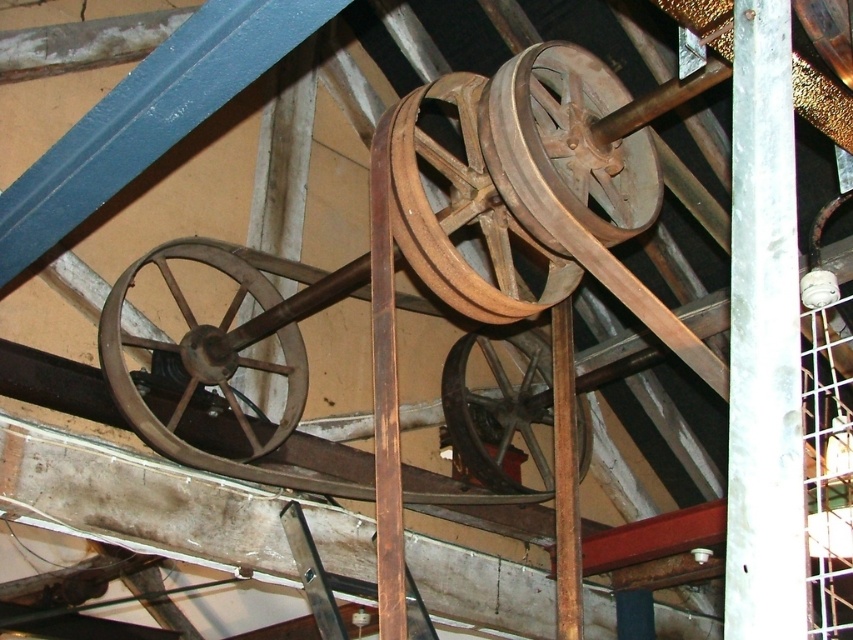
Question: Where is rustic wood wheel at center located in relation to wooden wheel at left in the image?

Choices:
 (A) right
 (B) left

Answer: (A)

Question: Is rustic wood wheel at center in front of wooden wheel at left?

Choices:
 (A) no
 (B) yes

Answer: (B)

Question: Is wooden pulley at center closer to the viewer compared to wooden wheel at center?

Choices:
 (A) no
 (B) yes

Answer: (B)

Question: Which point is closer to the camera?

Choices:
 (A) (469, 387)
 (B) (428, 212)

Answer: (B)

Question: Which point is farther to the camera?

Choices:
 (A) (463, 358)
 (B) (537, 122)
 (C) (126, 396)

Answer: (A)

Question: Which is nearer to the wooden wheel at center?

Choices:
 (A) wooden pulley at center
 (B) wooden wheel at left
 (C) rustic wood wheel at center

Answer: (B)